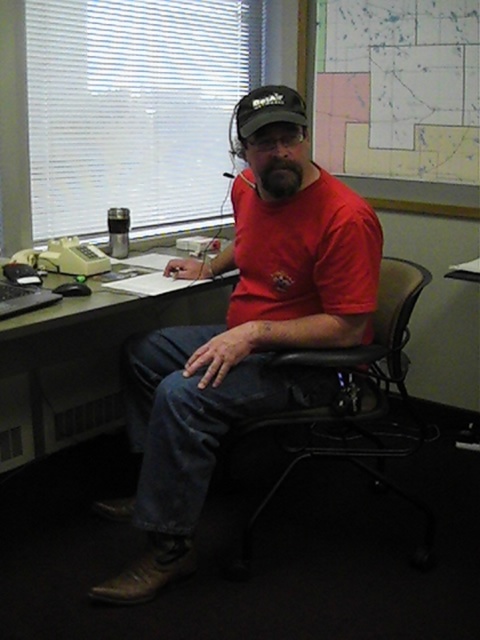
You are a delivery person who needs to place a package on the desk. The package is 1.8 meters long. Can you fit it between the red matte shirt at center and the camera?

The distance between the red matte shirt at center and the camera is 1.73 meters. Since the package is 1.8 meters long, it cannot fit between them as the space is shorter than the package.

You are an office worker who needs to place a new document on the desk. The document is larger than the map paper at upper right. Will it fit on the matte black desk at center?

The matte black desk at center is in front of the map paper at upper right, but the size relationship between the desk and the map paper isn not specified. Therefore, it is uncertain if the document will fit on the matte black desk at center.

You are a visitor in the office and need to sit down. The black plastic chair at center and the map paper at upper right are both in your view. Which object is bigger?

The black plastic chair at center is larger than the map paper at upper right.